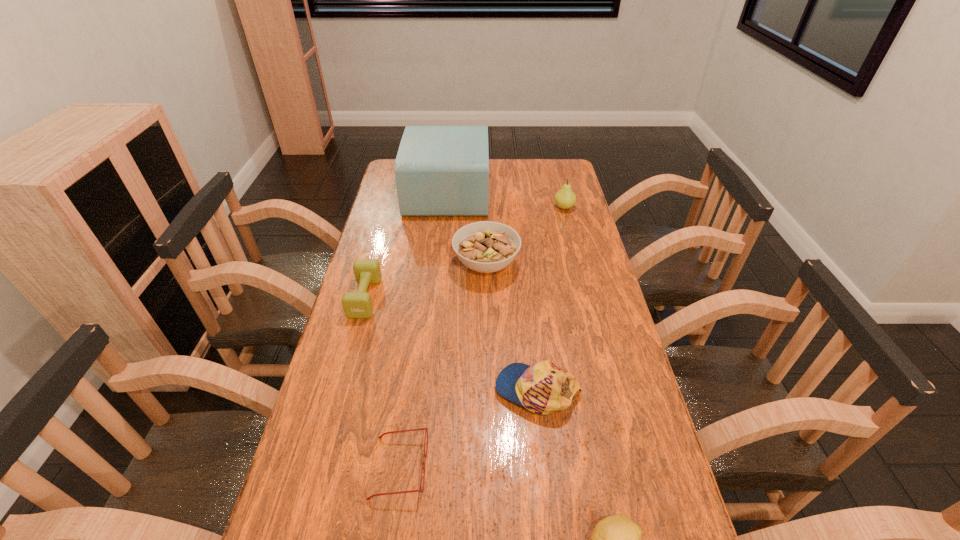
The height and width of the screenshot is (540, 960). Find the location of `object that stands as the fifth closest to the stew`. object that stands as the fifth closest to the stew is located at coordinates (426, 428).

Where is `object that ranks as the third closest to the leftmost object`? object that ranks as the third closest to the leftmost object is located at coordinates (426, 428).

Identify the location of vacant space that satisfies the following two spatial constraints: 1. on the front panel of the stew; 2. on the right side of the radio receiver. The height and width of the screenshot is (540, 960). (441, 264).

Identify the location of free region that satisfies the following two spatial constraints: 1. on the front panel of the radio receiver; 2. on the back side of the second tallest object. Image resolution: width=960 pixels, height=540 pixels. (446, 207).